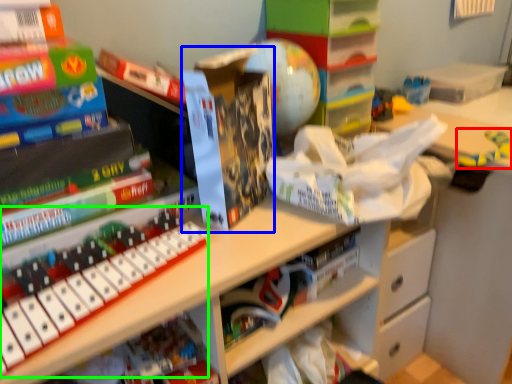
Question: Which is farther away from toy (highlighted by a red box)? paperback book (highlighted by a blue box) or musical keyboard (highlighted by a green box)?

Choices:
 (A) paperback book
 (B) musical keyboard

Answer: (B)